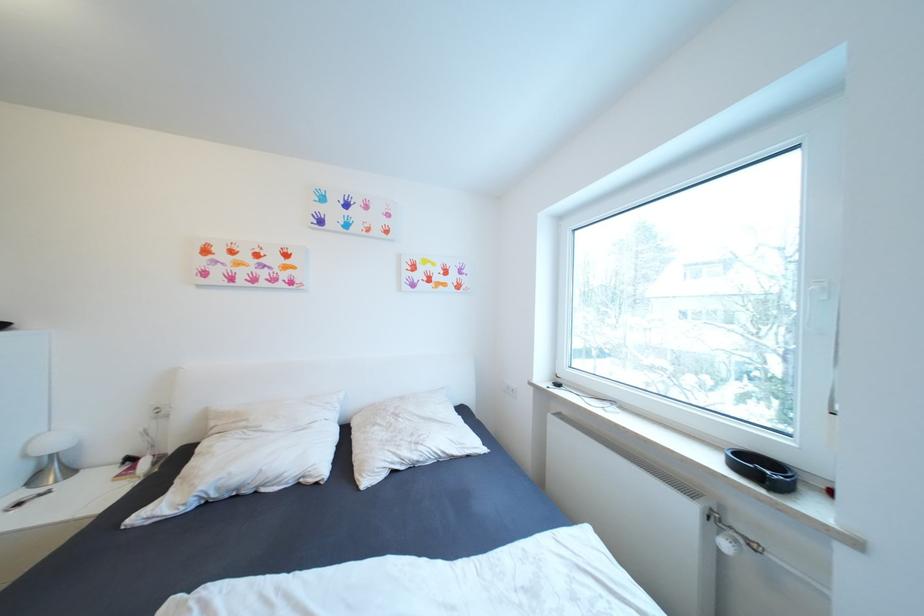
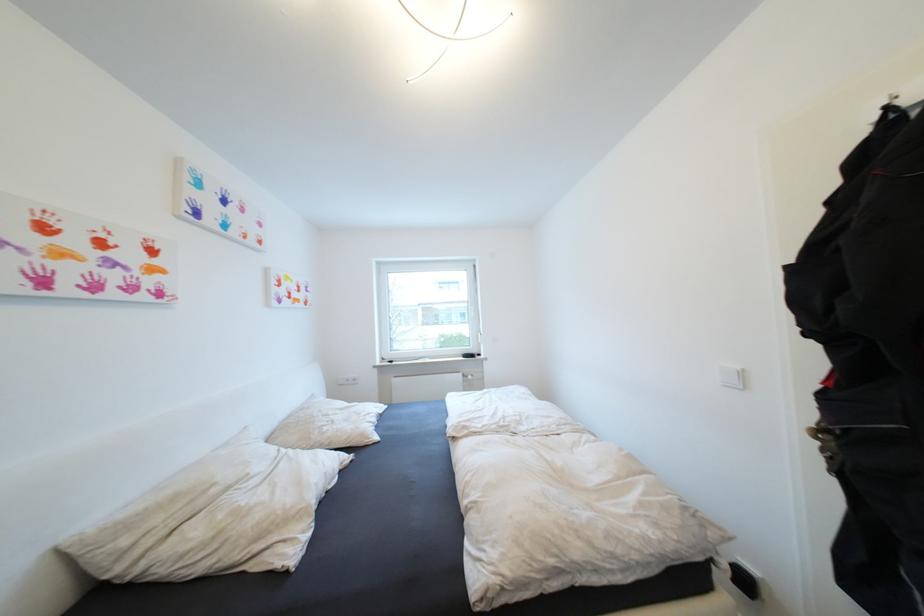
Find the pixel in the second image that matches point (220, 424) in the first image.

(131, 543)